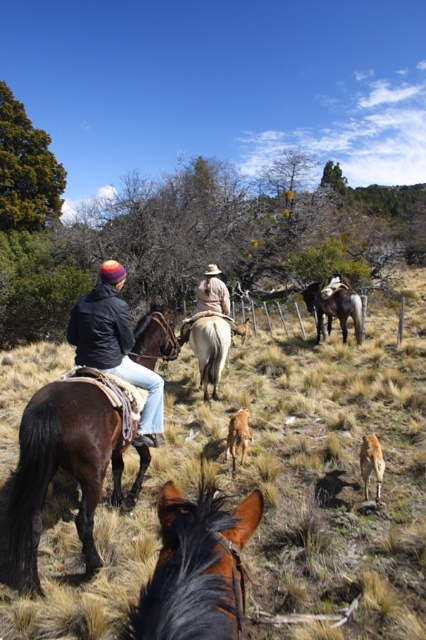
Question: Which object appears farthest from the camera in this image?

Choices:
 (A) shiny brown horse at left
 (B) brown glossy horse at center
 (C) shiny brown horse at center

Answer: (B)

Question: Is brown rough horse at upper left smaller than light brown horse at center?

Choices:
 (A) yes
 (B) no

Answer: (B)

Question: Where is brown rough horse at upper left located in relation to light brown horse at center in the image?

Choices:
 (A) right
 (B) left

Answer: (A)

Question: Which point is closer to the camera?

Choices:
 (A) (115, 300)
 (B) (333, 301)
 (C) (39, 404)

Answer: (C)

Question: Does shiny brown horse at left have a lesser width compared to light brown horse at center?

Choices:
 (A) yes
 (B) no

Answer: (B)

Question: Which is nearer to the shiny brown horse at left?

Choices:
 (A) brown glossy horse at center
 (B) matte black jacket at left
 (C) shiny brown horse at center

Answer: (B)